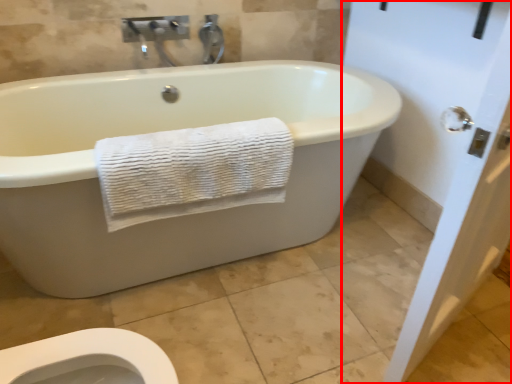
Question: From the image, what is the correct spatial relationship of screen door (annotated by the red box) in relation to towel?

Choices:
 (A) right
 (B) left

Answer: (A)